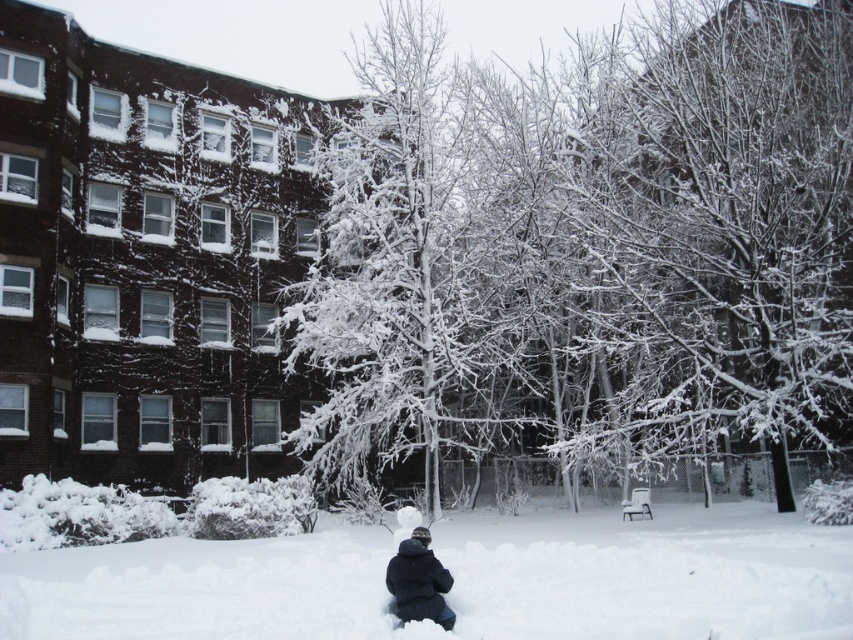
Question: Based on their relative distances, which object is nearer to the white fluffy snow at lower center?

Choices:
 (A) white frosty tree at center
 (B) black fuzzy jacket at lower center

Answer: (B)

Question: Does white frosty tree at center appear on the left side of black fuzzy jacket at lower center?

Choices:
 (A) no
 (B) yes

Answer: (A)

Question: Which of these objects is positioned closest to the white fluffy snow at lower center?

Choices:
 (A) black fuzzy jacket at lower center
 (B) white frosty tree at center

Answer: (A)

Question: Does white frosty tree at center have a lesser width compared to black fuzzy jacket at lower center?

Choices:
 (A) yes
 (B) no

Answer: (B)

Question: Which point is farther to the camera?

Choices:
 (A) white frosty tree at center
 (B) white fluffy snow at lower center
 (C) black fuzzy jacket at lower center

Answer: (A)

Question: Where is white frosty tree at center located in relation to black fuzzy jacket at lower center in the image?

Choices:
 (A) above
 (B) below

Answer: (A)